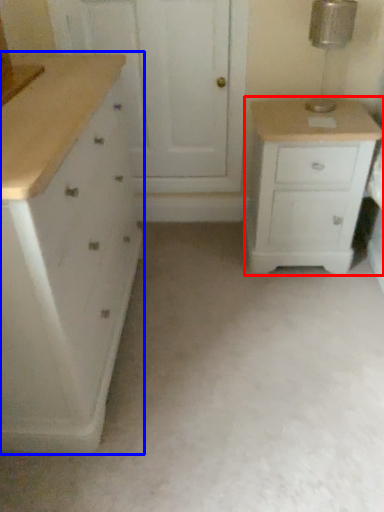
Question: Which of the following is the closest to the observer, chest of drawers (highlighted by a red box) or chest of drawers (highlighted by a blue box)?

Choices:
 (A) chest of drawers
 (B) chest of drawers

Answer: (B)